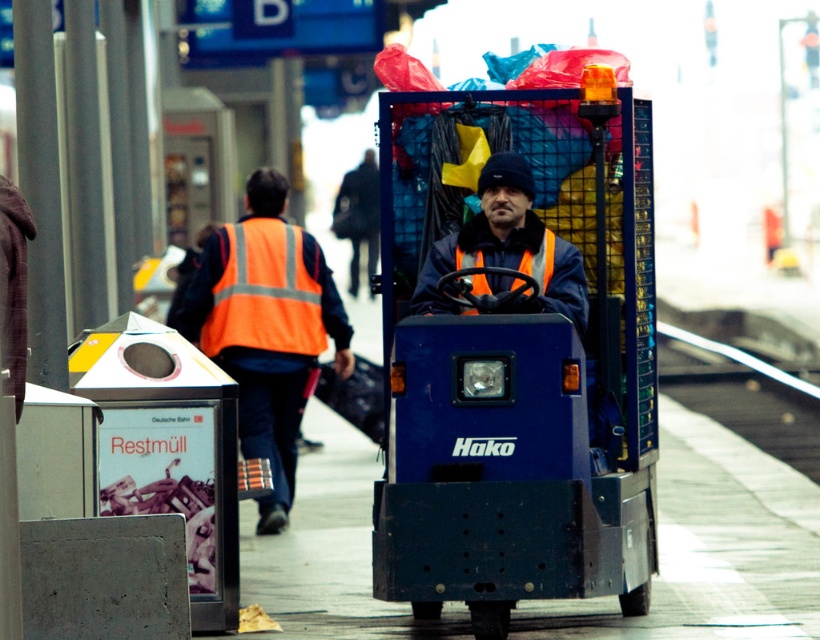
Question: Estimate the real-world distances between objects in this image. Which object is farther from the orange reflective vest at left?

Choices:
 (A) blue plastic garbage truck at center
 (B) high-visibility fabric safety vest at center-left

Answer: (A)

Question: Which point is closer to the camera?

Choices:
 (A) 231,256
 (B) 433,275
 (C) 686,314

Answer: (B)

Question: Among these points, which one is farthest from the camera?

Choices:
 (A) pyautogui.click(x=474, y=218)
 (B) pyautogui.click(x=262, y=241)
 (C) pyautogui.click(x=684, y=392)
 (D) pyautogui.click(x=543, y=561)

Answer: (C)

Question: Is blue plastic garbage truck at center above orange reflective vest at center?

Choices:
 (A) yes
 (B) no

Answer: (B)

Question: Is the position of orange reflective vest at center more distant than that of high-visibility fabric safety vest at center-left?

Choices:
 (A) yes
 (B) no

Answer: (B)

Question: Does orange reflective vest at left come in front of orange reflective safety vest at center?

Choices:
 (A) no
 (B) yes

Answer: (A)